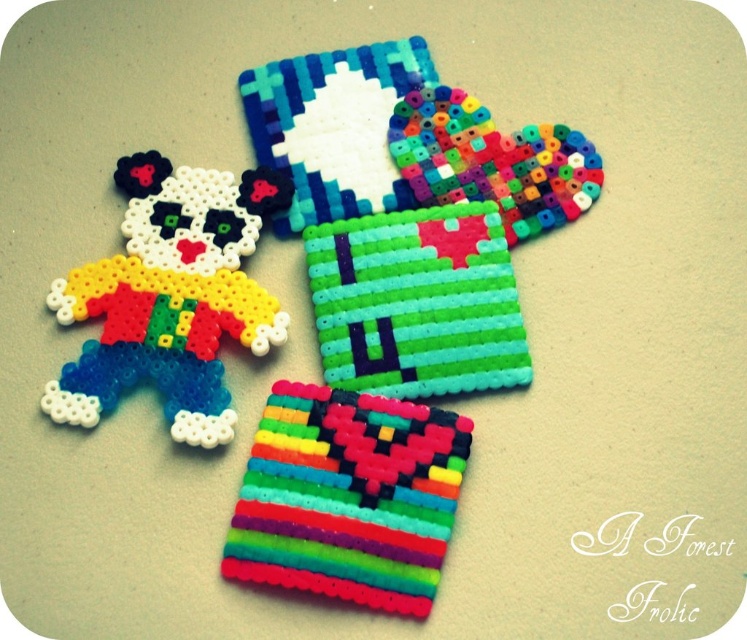
You are an artist trying to place a new bead art piece exactly at the center of the beige surface. You have a green matte pixelated square at center. Where should you place it?

The green matte pixelated square at center should be placed at the coordinates point (418, 301) to be at the center of the beige surface.

You are standing in front of the bead art display and want to touch the two points marked as point (328, 488) and point (503, 168). Which point will require you to reach further forward?

Point (503, 168) will require you to reach further forward because it is farther from the camera compared to point (328, 488).

You are an art curator planning to display the green matte pixelated square at center and the multicolored beads at center in a new exhibition. Based on their sizes, which object should be placed in a more prominent position to highlight its visual impact?

The green matte pixelated square at center should be placed in a more prominent position because it has a larger size compared to the multicolored beads at center, making it more visually striking.